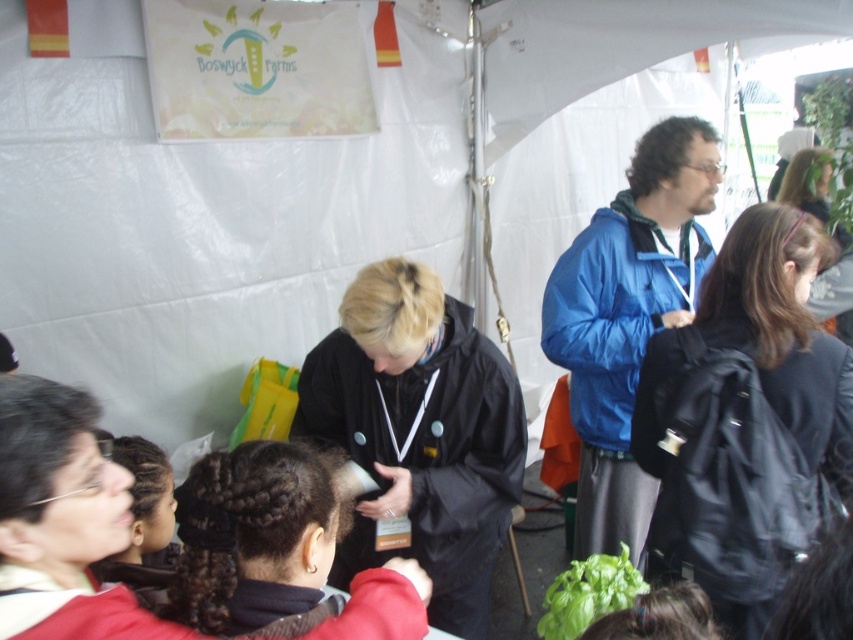
Between black matte jacket at center and black matte hair at center, which one has less height?

Standing shorter between the two is black matte hair at center.

Does point (399, 499) come behind point (190, 572)?

Yes, point (399, 499) is behind point (190, 572).

At what (x,y) coordinates should I click in order to perform the action: click on black matte jacket at center. Please return your answer as a coordinate pair (x, y). Looking at the image, I should click on (419, 435).

Does black matte backpack at center-right come behind black matte jacket at center?

Yes, it is behind black matte jacket at center.

Where is `black matte backpack at center-right`? black matte backpack at center-right is located at coordinates (746, 422).

Can you confirm if black matte jacket at center is smaller than black fabric jacket at center?

No, black matte jacket at center is not smaller than black fabric jacket at center.

Does black matte jacket at center come in front of black fabric jacket at center?

No, black matte jacket at center is further to the viewer.

Does point (471, 368) come farther from viewer compared to point (56, 381)?

No, it is in front of (56, 381).

Where is `black matte jacket at center`? black matte jacket at center is located at coordinates (419, 435).